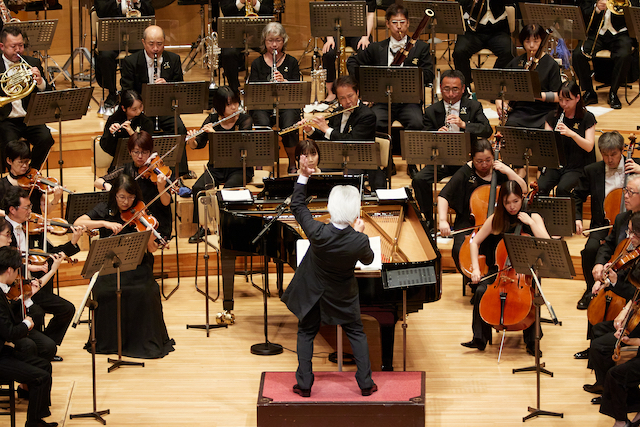
Locate an element on the screen. The height and width of the screenshot is (427, 640). base of music stand is located at coordinates [93, 414], [123, 362], [203, 327], [539, 413], [534, 369], [550, 320], [200, 239], [84, 324].